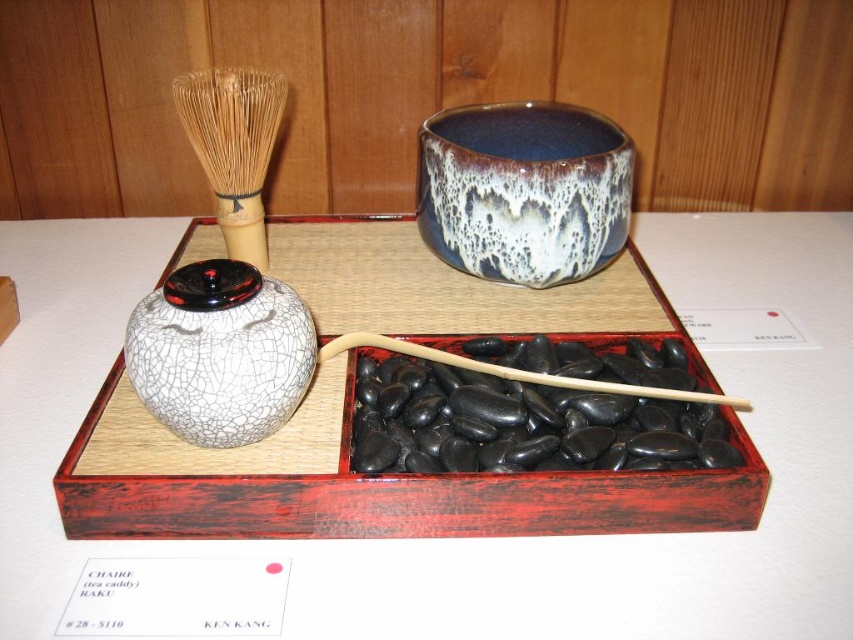
You are a guest at a tea ceremony and need to use the speckled ceramic bowl at center and the wooden stick at center. Which object is directly below the other?

The wooden stick at center is directly below the speckled ceramic bowl at center because the bowl is positioned over the stick.

You are holding a camera 3.56 feet away from the speckled ceramic bowl at center. If you want to take a photo of the bowl, will you need to zoom in or out to frame it properly?

The camera is exactly 3.56 feet away from the speckled ceramic bowl at center, so you do not need to adjust the zoom. The distance is already optimal for framing the bowl properly.